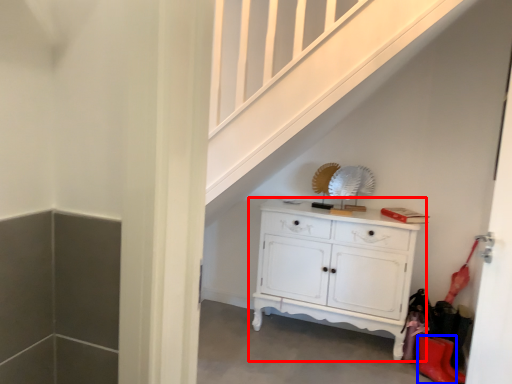
Question: Among these objects, which one is nearest to the camera, chest of drawers (highlighted by a red box) or shoe (highlighted by a blue box)?

Choices:
 (A) chest of drawers
 (B) shoe

Answer: (B)